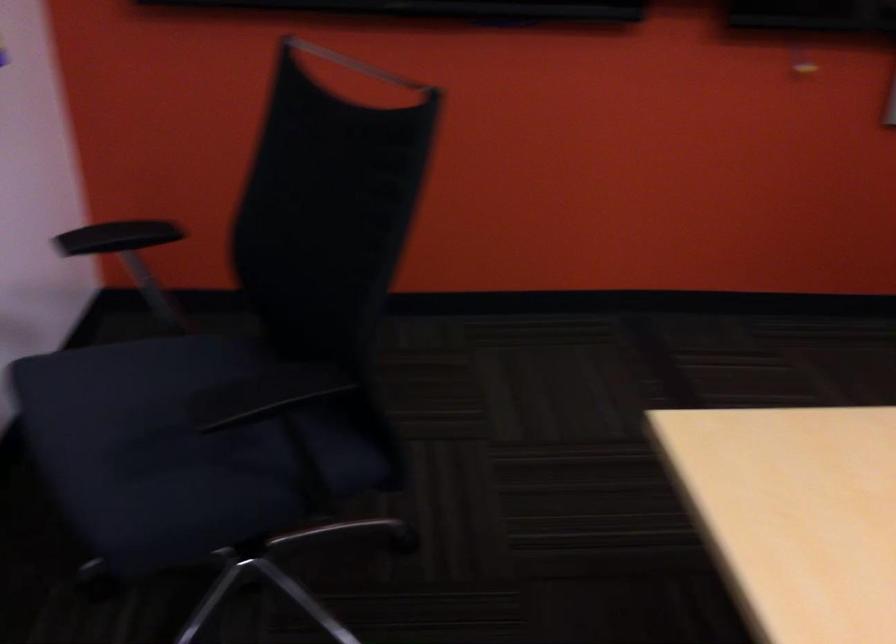
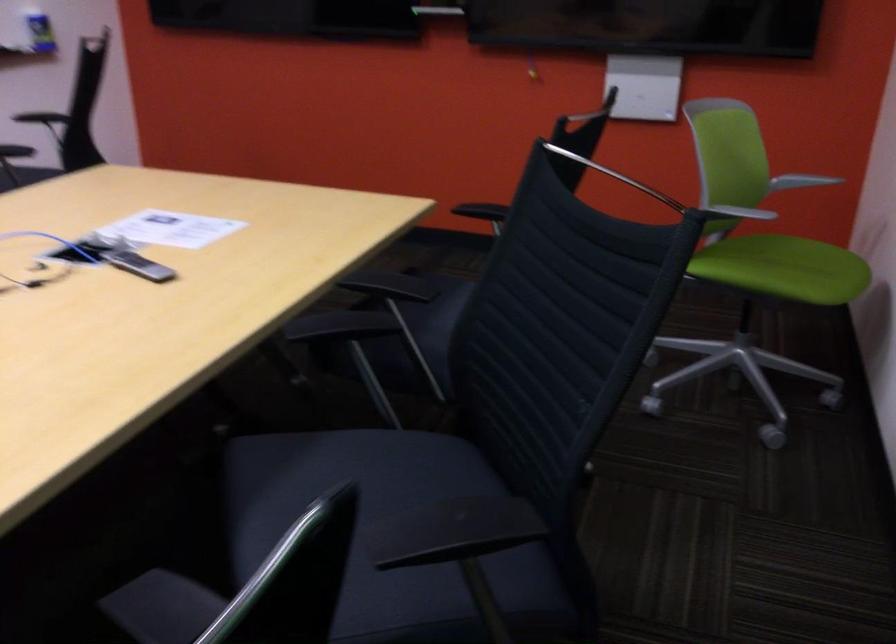
What movement of the cameraman would produce the second image?

The cameraman walked toward right, backward.